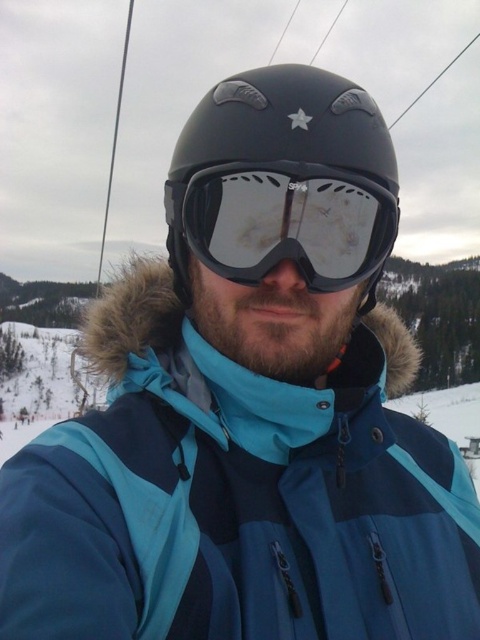
Question: Can you confirm if matte black helmet at center is positioned below matte black goggles at center?

Choices:
 (A) yes
 (B) no

Answer: (B)

Question: Which of the following is the closest to the observer?

Choices:
 (A) matte black helmet at center
 (B) matte black goggles at center

Answer: (B)

Question: Which point is farther to the camera?

Choices:
 (A) [240, 634]
 (B) [321, 180]
 (C) [192, 228]

Answer: (C)

Question: Does blue synthetic jacket at center have a lesser width compared to matte black goggles at center?

Choices:
 (A) no
 (B) yes

Answer: (A)

Question: Estimate the real-world distances between objects in this image. Which object is farther from the matte black helmet at center?

Choices:
 (A) matte black goggles at center
 (B) blue synthetic jacket at center

Answer: (B)

Question: Does blue synthetic jacket at center appear on the left side of matte black helmet at center?

Choices:
 (A) no
 (B) yes

Answer: (A)